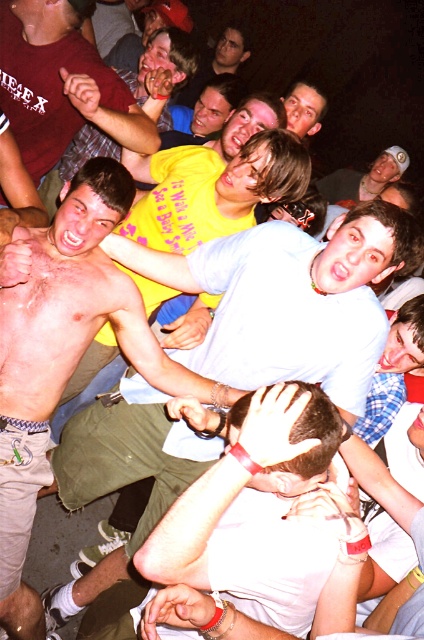
In the crowded nighttime event scene with people wearing wristbands and casual clothes, there is a white matte shirt at center located at point (220, 492). How would you describe the position of this white matte shirt at center relative to the other people in the image?

The white matte shirt at center is located at the coordinates (220, 492), which places it centrally within the image frame, likely making it stand out against the crowd due to its bright color and central positioning.

You are trying to locate a person wearing a white matte shirt at center in a crowded nighttime event. Given the coordinates provided, can you determine if this person is positioned closer to the left or right side of the image?

The white matte shirt at center is located at point 0.769 on the x and y axis, which means it is closer to the right side of the image.